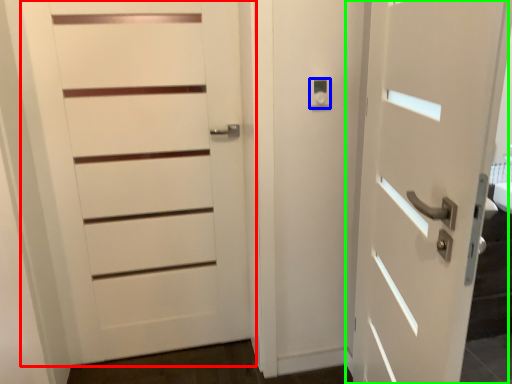
Question: Which object is positioned closest to door (highlighted by a red box)? Select from knob (highlighted by a blue box) and door (highlighted by a green box).

Choices:
 (A) knob
 (B) door

Answer: (A)